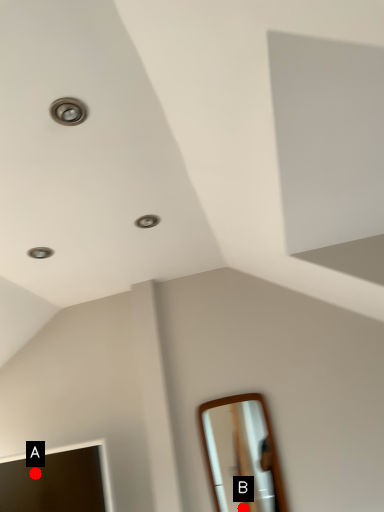
Question: Two points are circled on the image, labeled by A and B beside each circle. Among these points, which one is farthest from the camera?

Choices:
 (A) A is further
 (B) B is further

Answer: (B)